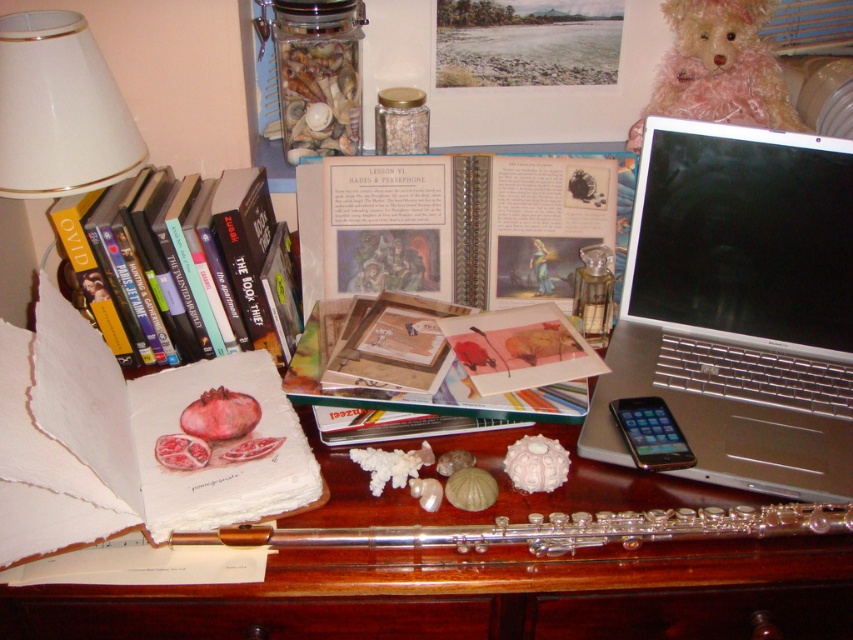
You are a student trying to organize your desk. You have two points marked on your desk where you want to place new items. The first point is at coordinate point [198,476] and the second is at point [254,268]. If you want to place a small statue closer to you, which point should you choose?

Point [198,476] is closer to the viewer than point [254,268], so you should place the small statue at point [198,476] to have it closer.

You are trying to place a new notebook on the desk but want to ensure there is enough vertical space between the silver metallic laptop at right and the white glossy lampshade at upper left. Based on the scene, is there sufficient space for the notebook?

The silver metallic laptop at right is much taller than the white glossy lampshade at upper left, so there is not enough vertical space between them to place the notebook.

You are a student trying to organize your desk. You have two points marked on your desk at coordinates point (664, 387) and point (550, 392). If you want to place a new item between them, which point should you move closer to the front?

Point (550, 392) is in front of point (664, 387). To place the new item between them, you should move point (664, 387) closer to the front towards point (550, 392).